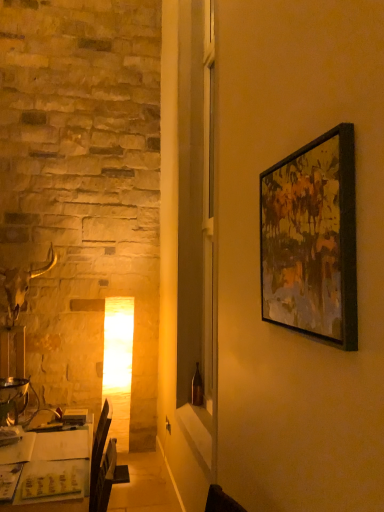
Question: In terms of width, does black matte picture frame at upper right look wider or thinner when compared to white paper at lower left?

Choices:
 (A) wide
 (B) thin

Answer: (B)

Question: Considering the positions of black matte picture frame at upper right and white paper at lower left in the image, is black matte picture frame at upper right taller or shorter than white paper at lower left?

Choices:
 (A) short
 (B) tall

Answer: (A)

Question: Considering the positions of point (288, 207) and point (54, 507), is point (288, 207) closer or farther from the camera than point (54, 507)?

Choices:
 (A) closer
 (B) farther

Answer: (A)

Question: From a real-world perspective, is white paper at lower left positioned above or below black matte picture frame at upper right?

Choices:
 (A) below
 (B) above

Answer: (A)

Question: In terms of width, does white paper at lower left look wider or thinner when compared to black matte picture frame at upper right?

Choices:
 (A) wide
 (B) thin

Answer: (A)

Question: From the image's perspective, relative to black matte picture frame at upper right, is white paper at lower left above or below?

Choices:
 (A) below
 (B) above

Answer: (A)

Question: In terms of height, does white paper at lower left look taller or shorter compared to black matte picture frame at upper right?

Choices:
 (A) tall
 (B) short

Answer: (A)